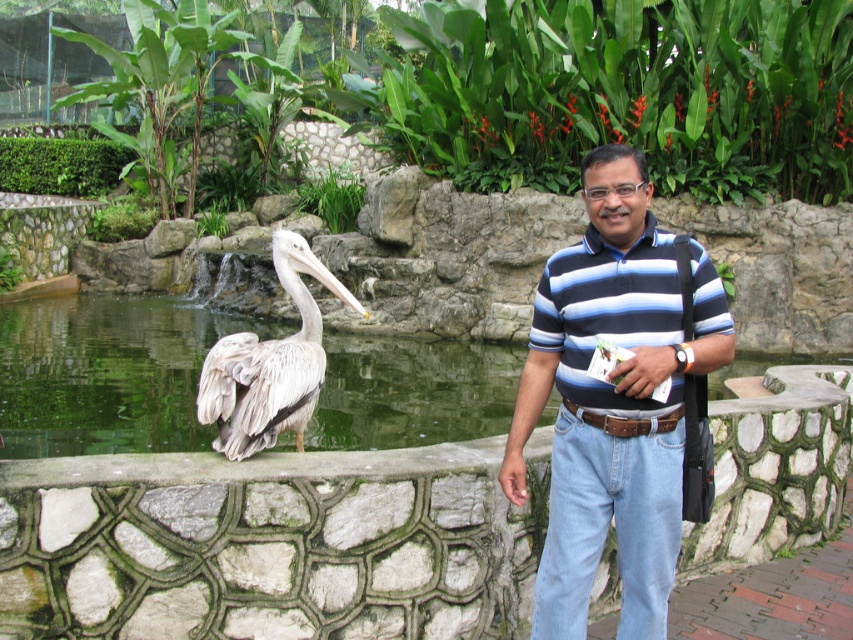
Question: Is blue striped polo shirt at center wider than blue striped polo shirt at right?

Choices:
 (A) no
 (B) yes

Answer: (B)

Question: Does blue striped polo shirt at center have a smaller size compared to blue striped polo shirt at right?

Choices:
 (A) no
 (B) yes

Answer: (A)

Question: Is blue striped polo shirt at right positioned at the back of white feathered pelican at center?

Choices:
 (A) no
 (B) yes

Answer: (A)

Question: Which object appears closest to the camera in this image?

Choices:
 (A) blue striped polo shirt at center
 (B) blue striped polo shirt at right

Answer: (A)

Question: Which of the following is the closest to the observer?

Choices:
 (A) blue striped polo shirt at right
 (B) white feathered pelican at center

Answer: (A)

Question: Which object is positioned closest to the blue striped polo shirt at right?

Choices:
 (A) blue striped polo shirt at center
 (B) white feathered pelican at center

Answer: (A)